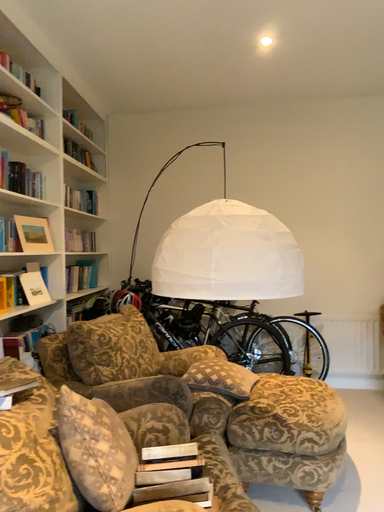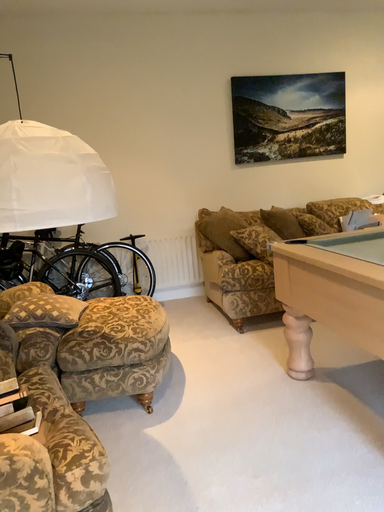
Question: Which way did the camera rotate in the video?

Choices:
 (A) rotated upward
 (B) rotated downward

Answer: (B)